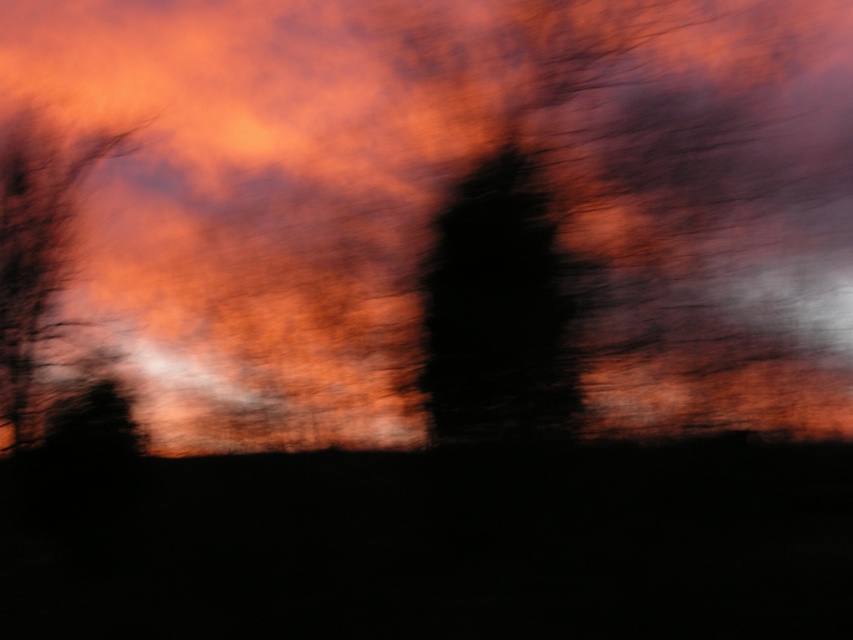
Is point (488, 77) positioned after point (500, 332)?

That is True.

The width and height of the screenshot is (853, 640). I want to click on orange matte cloud at upper center, so click(444, 202).

Image resolution: width=853 pixels, height=640 pixels. I want to click on orange matte cloud at upper center, so click(x=444, y=202).

Can you confirm if black matte tree at center is wider than smooth bark tree at left?

Incorrect, black matte tree at center's width does not surpass smooth bark tree at left's.

Looking at this image, who is taller, black matte tree at center or smooth bark tree at left?

smooth bark tree at left is taller.

Which is behind, point (456, 433) or point (44, 227)?

Point (44, 227)

Where is `black matte tree at center`? black matte tree at center is located at coordinates (502, 308).

Between point (816, 221) and point (3, 298), which one is positioned in front?

Point (816, 221) is more forward.

The image size is (853, 640). What are the coordinates of `orange matte cloud at upper center` in the screenshot? It's located at (444, 202).

Between point (213, 419) and point (3, 198), which one is positioned behind?

The point (3, 198) is behind.

Locate an element on the screen. orange matte cloud at upper center is located at coordinates (444, 202).